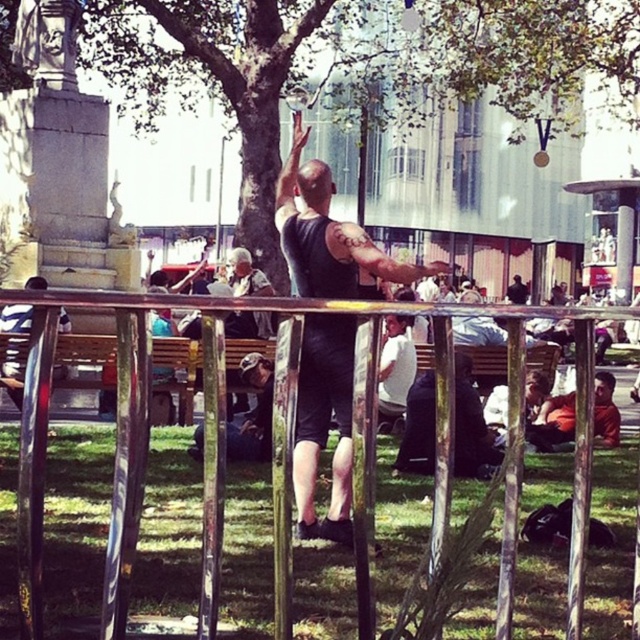
You are a photographer trying to capture a photo of the black matte tank top at center. The metallic silver fence at center is blocking your view. Can you move the fence to get a clear shot?

The metallic silver fence at center has a smaller size compared to black matte tank top at center, so you can move the fence to get a clear shot since it is smaller than the tank top.

You are standing at the railing and want to take a photo of the black matte tank top at center and the green leafy tree at center. Which object should you frame first in your camera viewfinder to ensure both are in the shot?

You should frame the green leafy tree at center first because it is to the left of the black matte tank top at center, so positioning it first ensures both are included in the shot.

You are a painter setting up an easel in the park and want to place it between the metallic silver fence at center and the black matte tank top at center. Based on their widths, which object should you position closer to your easel to ensure stability?

The metallic silver fence at center is wider than the black matte tank top at center, so positioning the easel closer to the metallic silver fence at center would provide better stability due to its greater width.